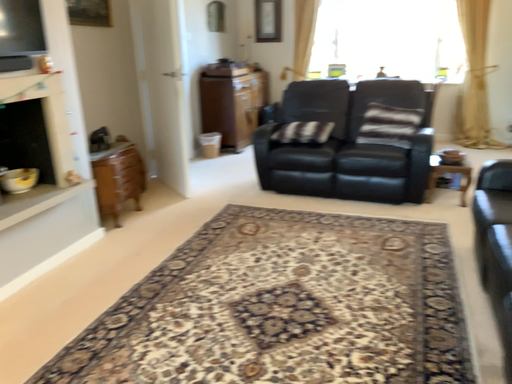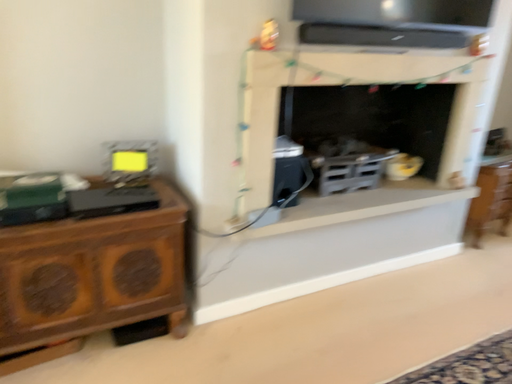
Question: Which way did the camera rotate in the video?

Choices:
 (A) rotated upward
 (B) rotated downward

Answer: (A)